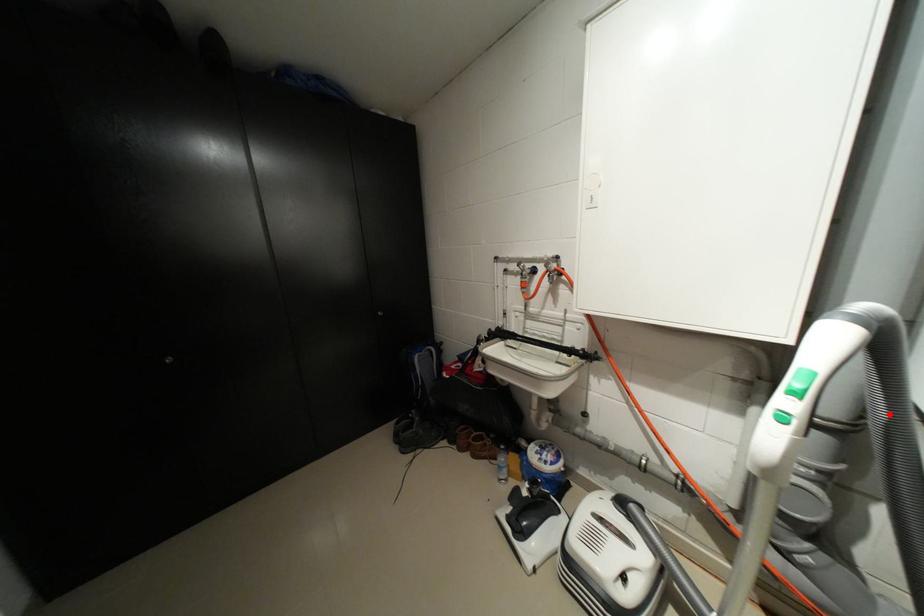
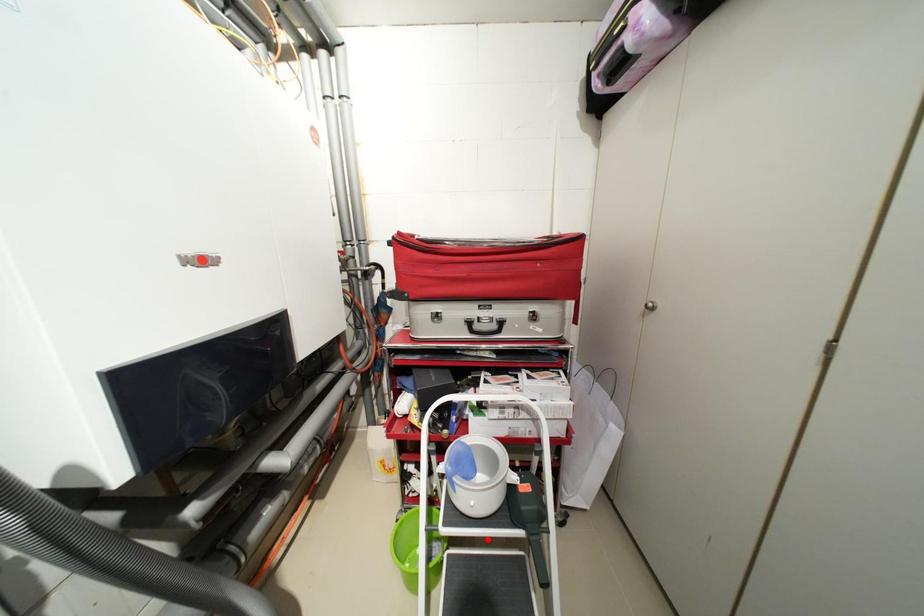
Looking at this image, I am providing you with two images of the same scene from different viewpoints. A red point is marked on the first image and another point is marked on the second image. Are the points marked in image1 and image2 representing the same 3D position?

No